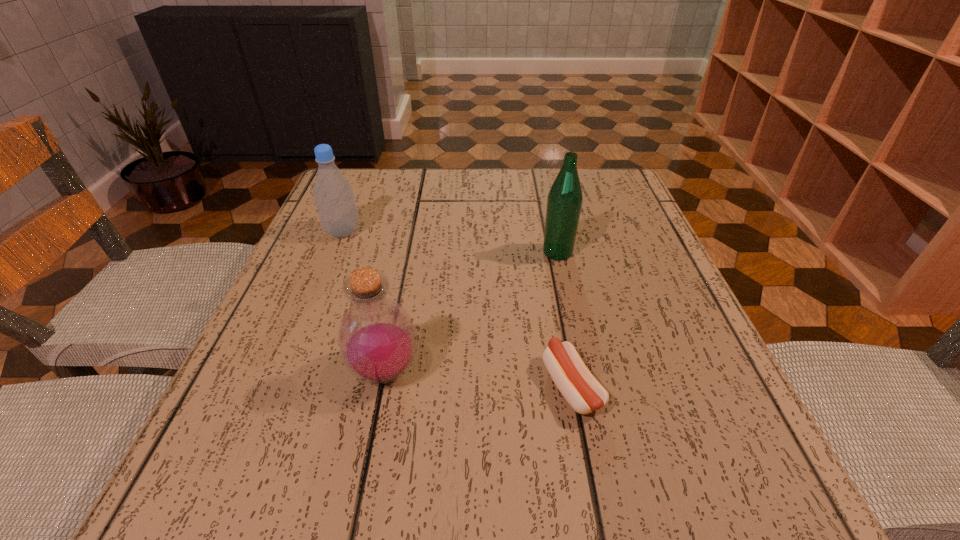
Where is `the second closest bottle to the second bottle from left to right`? The image size is (960, 540). the second closest bottle to the second bottle from left to right is located at coordinates (564, 202).

At what (x,y) coordinates should I click in order to perform the action: click on bottle identified as the second closest to the sausage. Please return your answer as a coordinate pair (x, y). This screenshot has width=960, height=540. Looking at the image, I should click on (564, 202).

Where is `free space that satisfies the following two spatial constraints: 1. on the back side of the second bottle from left to right; 2. on the left side of the rightmost bottle`? Image resolution: width=960 pixels, height=540 pixels. free space that satisfies the following two spatial constraints: 1. on the back side of the second bottle from left to right; 2. on the left side of the rightmost bottle is located at coordinates (408, 252).

Locate an element on the screen. The width and height of the screenshot is (960, 540). vacant space that satisfies the following two spatial constraints: 1. on the front side of the leftmost object; 2. on the left side of the sausage is located at coordinates (279, 386).

In order to click on vacant space that satisfies the following two spatial constraints: 1. on the front side of the second bottle from right to left; 2. on the right side of the farthest bottle in this screenshot , I will do `click(286, 371)`.